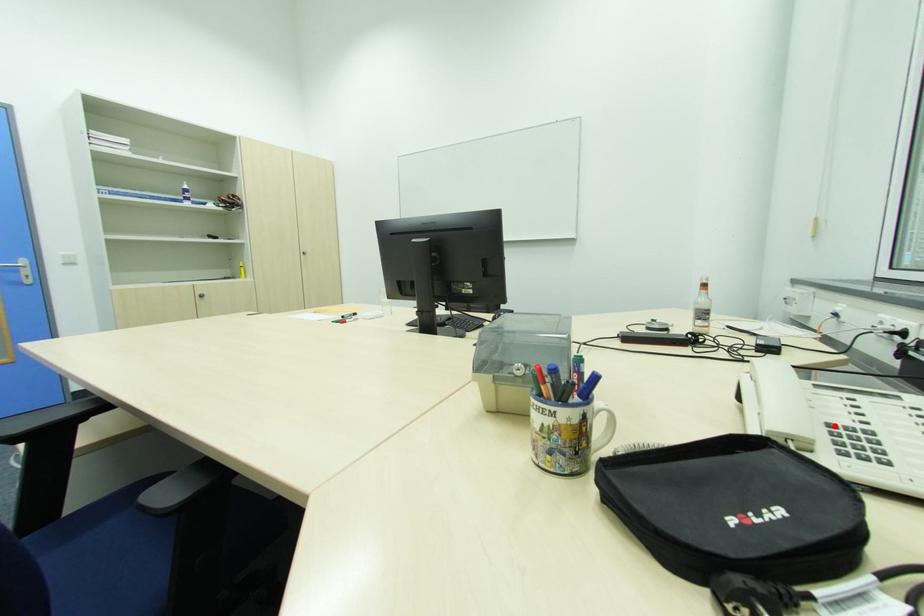
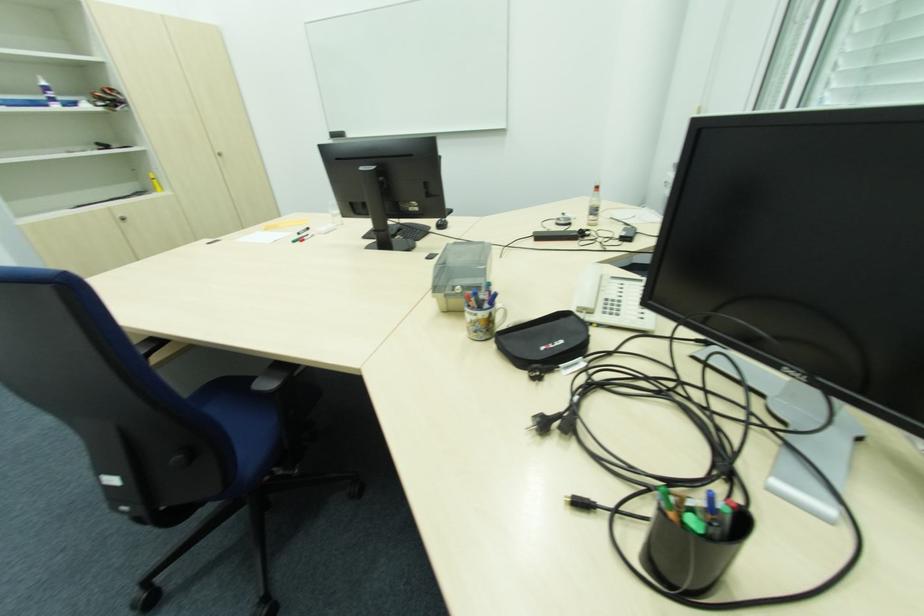
In the second image, find the point that corresponds to the highlighted location in the first image.

(610, 300)